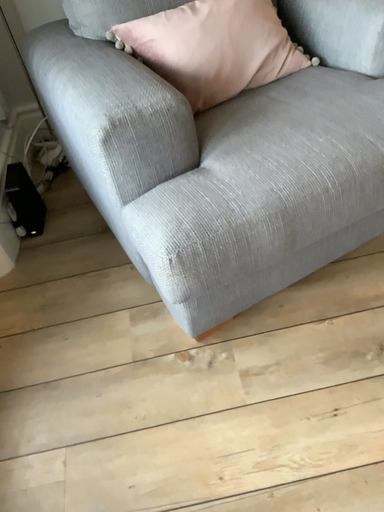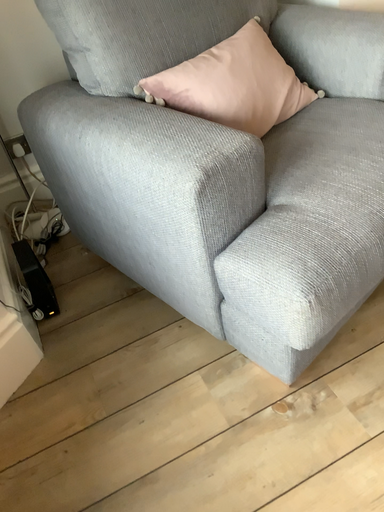
Question: How did the camera likely rotate when shooting the video?

Choices:
 (A) rotated upward
 (B) rotated downward

Answer: (A)